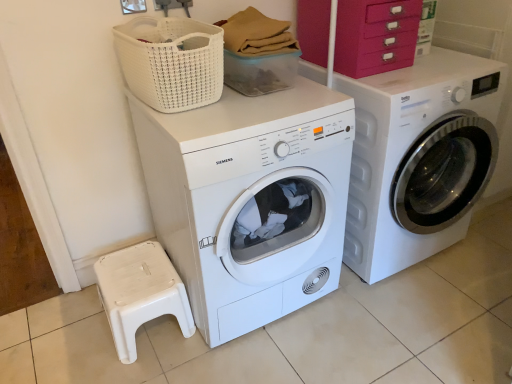
Image resolution: width=512 pixels, height=384 pixels. Find the location of `vacant area that is situated to the right of white matte washing machine at center, which is the 1th washing machine from left to right`. vacant area that is situated to the right of white matte washing machine at center, which is the 1th washing machine from left to right is located at coordinates (402, 324).